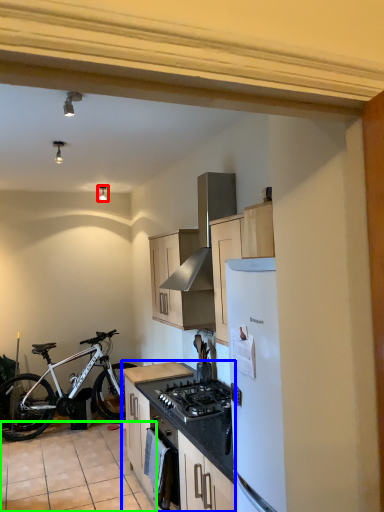
Question: Considering the real-world distances, which object is closest to light fixture (highlighted by a red box)? cabinetry (highlighted by a blue box) or tile (highlighted by a green box).

Choices:
 (A) cabinetry
 (B) tile

Answer: (B)